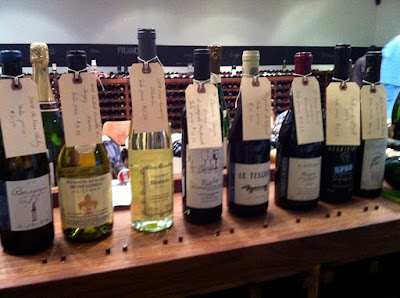
The height and width of the screenshot is (298, 400). I want to click on wine rack, so 109,82, 125,102, 110,108, 177,83, 177,95, 231,90, 231,100, 282,88, 282,101.